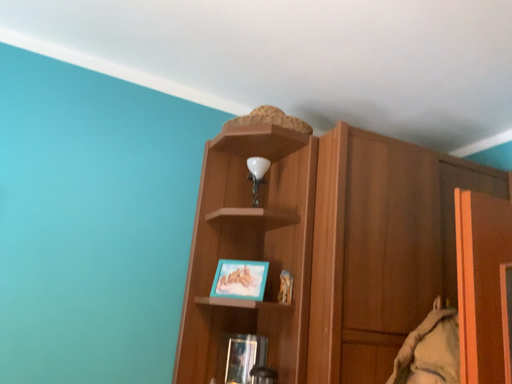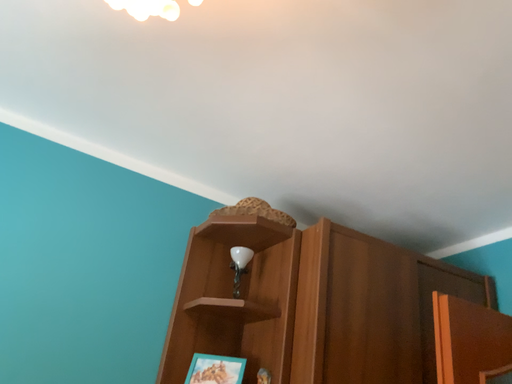
Question: How did the camera likely rotate when shooting the video?

Choices:
 (A) rotated downward
 (B) rotated upward

Answer: (B)